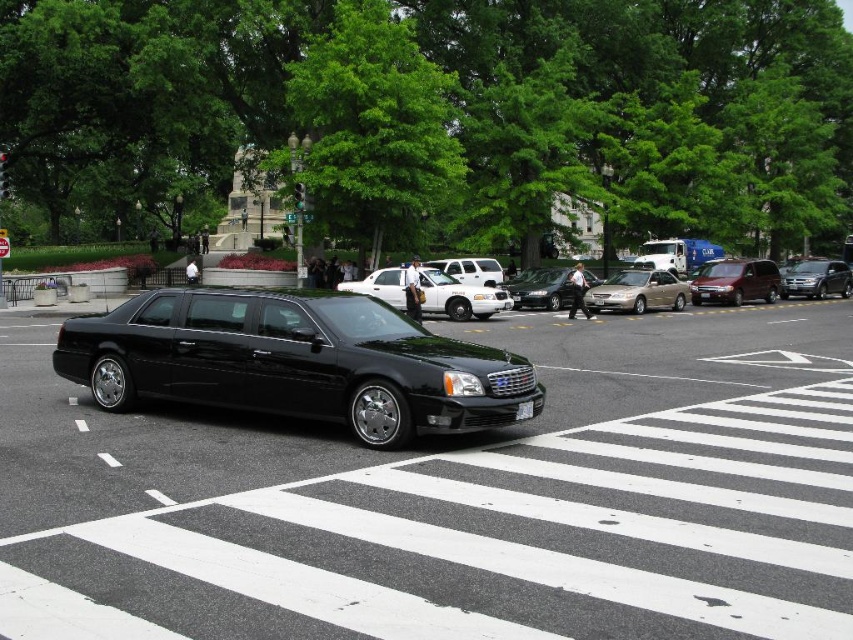
Question: Does black glossy car at center appear on the right side of metallic gold sedan at center?

Choices:
 (A) yes
 (B) no

Answer: (B)

Question: Estimate the real-world distances between objects in this image. Which object is farther from the metallic maroon minivan at right?

Choices:
 (A) white glossy sedan at center
 (B) shiny silver sedan at center
 (C) shiny black limousine at center

Answer: (C)

Question: Which of the following is the closest to the observer?

Choices:
 (A) (486, 316)
 (B) (566, 276)
 (C) (844, 284)
 (D) (682, 307)

Answer: (A)

Question: Is black glossy car at center thinner than satin silver suv at right?

Choices:
 (A) yes
 (B) no

Answer: (B)

Question: Which point is farther from the camera taking this photo?

Choices:
 (A) (527, 410)
 (B) (558, 278)

Answer: (B)

Question: Is shiny black limousine at center smaller than black plastic license plate at center?

Choices:
 (A) yes
 (B) no

Answer: (B)